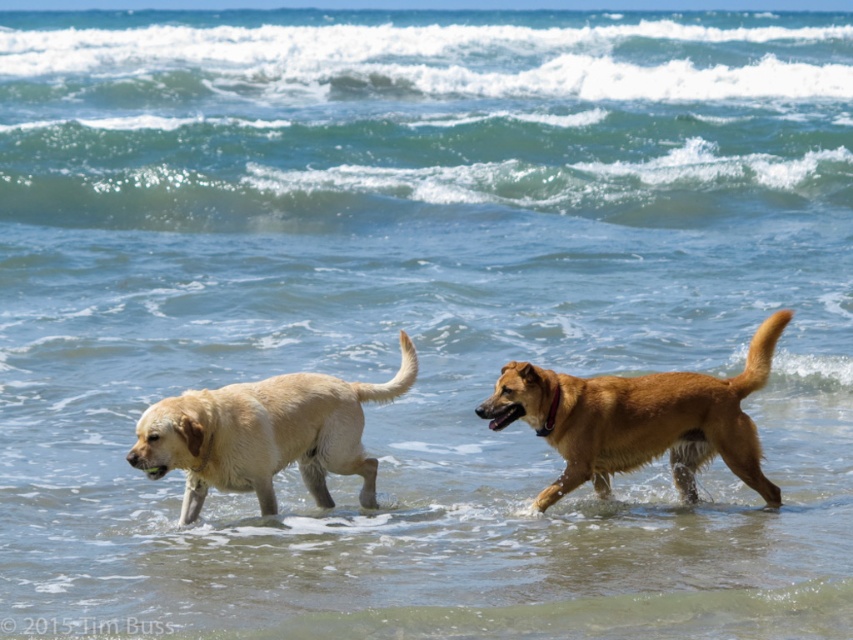
How far apart are brown furry dog at center and light brown fur dog at left?

brown furry dog at center and light brown fur dog at left are 1.17 meters apart.

Does brown furry dog at center appear under light brown fur dog at left?

No.

Image resolution: width=853 pixels, height=640 pixels. Describe the element at coordinates (640, 419) in the screenshot. I see `brown furry dog at center` at that location.

Identify the location of brown furry dog at center. (640, 419).